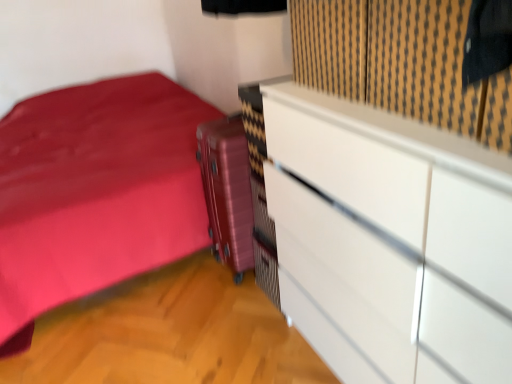
In order to face white glossy chest of drawers at upper right, should I rotate leftwards or rightwards?

Turn right by 19.301 degrees to look at white glossy chest of drawers at upper right.

Measure the distance between metallic pink suitcase at center and camera.

The distance of metallic pink suitcase at center from camera is 1.72 meters.

You are a GUI agent. You are given a task and a screenshot of the screen. Output one action in this format:
    pyautogui.click(x=<x>, y=<y>)
    Task: Click on the metallic pink suitcase at center
    The image size is (512, 384).
    Given the screenshot: What is the action you would take?
    pyautogui.click(x=227, y=191)

I want to click on white glossy chest of drawers at upper right, so click(389, 241).

This screenshot has width=512, height=384. Identify the location of chest of drawers in front of the metallic pink suitcase at center. (389, 241).

Between white glossy chest of drawers at upper right and metallic pink suitcase at center, which one has larger size?

white glossy chest of drawers at upper right is bigger.

Which of these two, black textured curtain at upper right or white glossy chest of drawers at upper right, is bigger?

Bigger between the two is white glossy chest of drawers at upper right.

Which is less distant, (413, 93) or (311, 137)?

The point (413, 93) is closer.

Considering the sizes of black textured curtain at upper right and white glossy chest of drawers at upper right in the image, is black textured curtain at upper right wider or thinner than white glossy chest of drawers at upper right?

black textured curtain at upper right is thinner than white glossy chest of drawers at upper right.

Is black textured curtain at upper right further to the viewer compared to white glossy chest of drawers at upper right?

Yes, black textured curtain at upper right is further from the viewer.

Can you confirm if black textured curtain at upper right is smaller than metallic pink suitcase at center?

Yes, black textured curtain at upper right is smaller than metallic pink suitcase at center.

Looking at this image, from the image's perspective, between black textured curtain at upper right and metallic pink suitcase at center, who is located below?

metallic pink suitcase at center.

This screenshot has height=384, width=512. In order to click on curtain lying above the metallic pink suitcase at center (from the image's perspective) in this screenshot , I will do `click(389, 56)`.

Is point (340, 24) behind point (219, 215)?

No, (340, 24) is in front of (219, 215).

In the scene shown: Which object is wider, metallic pink suitcase at center or white glossy chest of drawers at upper right?

Wider between the two is white glossy chest of drawers at upper right.

From a real-world perspective, is metallic pink suitcase at center below white glossy chest of drawers at upper right?

Yes, from a real-world perspective, metallic pink suitcase at center is below white glossy chest of drawers at upper right.

Considering the positions of objects metallic pink suitcase at center and white glossy chest of drawers at upper right in the image provided, who is more to the left, metallic pink suitcase at center or white glossy chest of drawers at upper right?

metallic pink suitcase at center.

From the image's perspective, is white glossy chest of drawers at upper right located above black textured curtain at upper right?

No, from the image's perspective, white glossy chest of drawers at upper right is not over black textured curtain at upper right.

Based on the photo, choose the correct answer: Is white glossy chest of drawers at upper right inside black textured curtain at upper right or outside it?

white glossy chest of drawers at upper right is located beyond the bounds of black textured curtain at upper right.

From the picture: Considering the sizes of objects white glossy chest of drawers at upper right and black textured curtain at upper right in the image provided, who is wider, white glossy chest of drawers at upper right or black textured curtain at upper right?

With larger width is white glossy chest of drawers at upper right.

Considering their positions, is white glossy chest of drawers at upper right located in front of or behind black textured curtain at upper right?

Visually, white glossy chest of drawers at upper right is located in front of black textured curtain at upper right.

From the picture: Are metallic pink suitcase at center and black textured curtain at upper right making contact?

metallic pink suitcase at center and black textured curtain at upper right are not in contact.

Is metallic pink suitcase at center located outside black textured curtain at upper right?

Indeed, metallic pink suitcase at center is completely outside black textured curtain at upper right.

Can you confirm if metallic pink suitcase at center is smaller than black textured curtain at upper right?

Incorrect, metallic pink suitcase at center is not smaller in size than black textured curtain at upper right.

Is metallic pink suitcase at center turned away from black textured curtain at upper right?

No, metallic pink suitcase at center is not facing away from black textured curtain at upper right.

Find the location of `chest of drawers located on the right of metallic pink suitcase at center`. chest of drawers located on the right of metallic pink suitcase at center is located at coordinates (389, 241).

Locate an element on the screen. The height and width of the screenshot is (384, 512). curtain above the white glossy chest of drawers at upper right (from a real-world perspective) is located at coordinates tap(389, 56).

From the image, which object appears to be farther from metallic pink suitcase at center, black textured curtain at upper right or white glossy chest of drawers at upper right?

The object further to metallic pink suitcase at center is black textured curtain at upper right.

Considering their positions, is white glossy chest of drawers at upper right positioned further to metallic pink suitcase at center than black textured curtain at upper right?

black textured curtain at upper right.

Estimate the real-world distances between objects in this image. Which object is closer to black textured curtain at upper right, white glossy chest of drawers at upper right or metallic pink suitcase at center?

The object closer to black textured curtain at upper right is white glossy chest of drawers at upper right.

Which object lies further to the anchor point white glossy chest of drawers at upper right, black textured curtain at upper right or metallic pink suitcase at center?

Based on the image, metallic pink suitcase at center appears to be further to white glossy chest of drawers at upper right.

From the image, which object appears to be nearer to white glossy chest of drawers at upper right, metallic pink suitcase at center or black textured curtain at upper right?

The object closer to white glossy chest of drawers at upper right is black textured curtain at upper right.

Looking at the image, which one is located further to black textured curtain at upper right, metallic pink suitcase at center or white glossy chest of drawers at upper right?

Among the two, metallic pink suitcase at center is located further to black textured curtain at upper right.

This screenshot has height=384, width=512. Identify the location of curtain between white glossy chest of drawers at upper right and metallic pink suitcase at center from front to back. pyautogui.click(x=389, y=56).